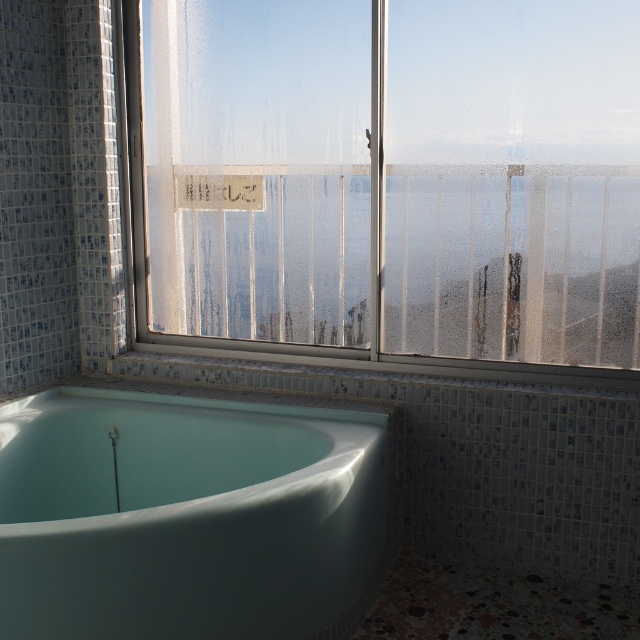
Who is more forward, (513, 132) or (54, 602)?

Point (54, 602) is in front.

The height and width of the screenshot is (640, 640). In order to click on frosted glass window at upper center in this screenshot , I will do `click(387, 182)`.